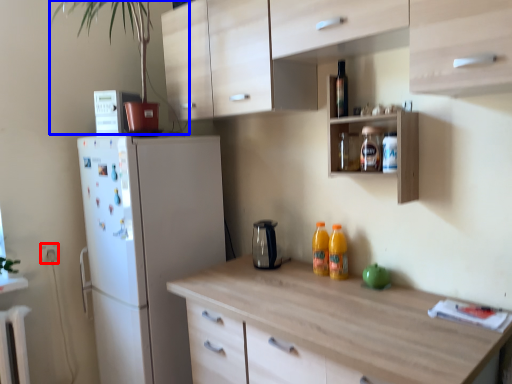
Question: Among these objects, which one is farthest to the camera, electric outlet (highlighted by a red box) or plant (highlighted by a blue box)?

Choices:
 (A) electric outlet
 (B) plant

Answer: (A)